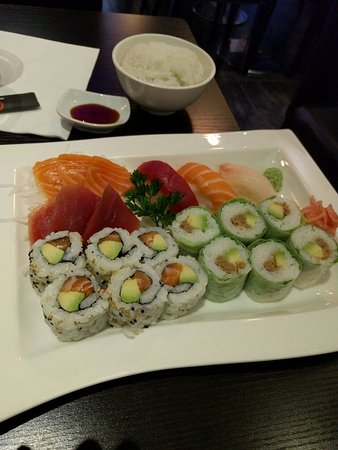
At what (x,y) coordinates should I click in order to perform the action: click on table. Please return your answer as a coordinate pair (x, y). This screenshot has width=338, height=450. Looking at the image, I should click on (243, 423).